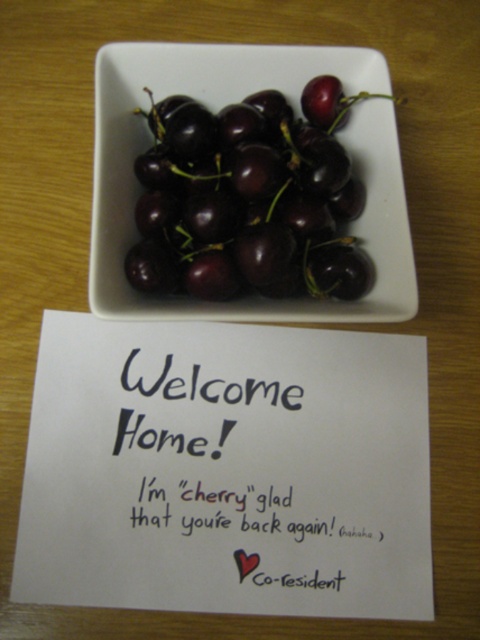
Who is taller, shiny dark red cherries at center or black paper at upper center?

With more height is shiny dark red cherries at center.

What do you see at coordinates (249, 198) in the screenshot?
I see `shiny dark red cherries at center` at bounding box center [249, 198].

What are the coordinates of `shiny dark red cherries at center` in the screenshot? It's located at (249, 198).